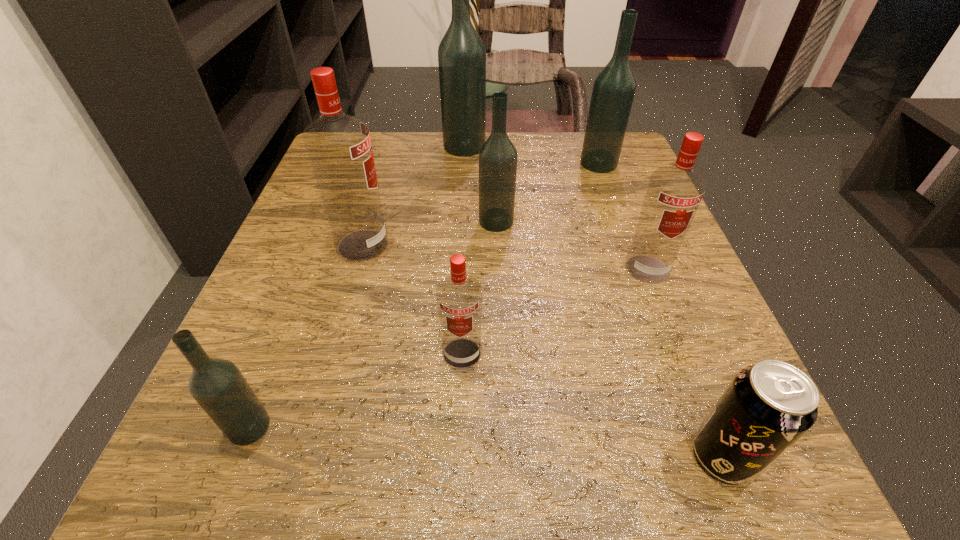
I want to click on the leftmost vodka, so click(x=217, y=385).

This screenshot has height=540, width=960. What are the coordinates of `the shortest object` in the screenshot? It's located at (768, 406).

In order to click on free space located on the right of the tallest object in this screenshot , I will do `click(563, 146)`.

The image size is (960, 540). I want to click on blank space located on the back of the second biggest black vodka, so click(x=590, y=141).

The width and height of the screenshot is (960, 540). In order to click on vacant space located on the front label of the biggest red vodka in this screenshot , I will do `click(451, 245)`.

The image size is (960, 540). What are the coordinates of `free space located 0.060m on the back of the second smallest black vodka` in the screenshot? It's located at (495, 193).

Find the location of a particular element. blank space located 0.080m on the front label of the rightmost red vodka is located at coordinates (668, 324).

The width and height of the screenshot is (960, 540). I want to click on vacant point located on the front label of the smallest red vodka, so click(458, 477).

Where is `vacant space situated 0.250m on the back of the smallest black vodka`? The width and height of the screenshot is (960, 540). vacant space situated 0.250m on the back of the smallest black vodka is located at coordinates (310, 271).

I want to click on blank space located 0.210m on the left of the shortest object, so click(513, 456).